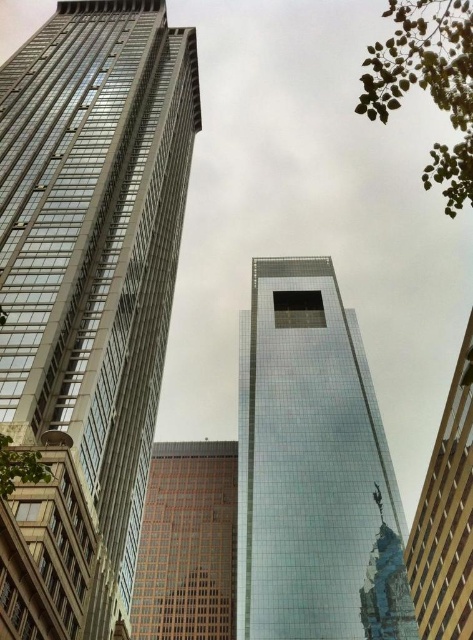
You are a drone operator tasked with flying a drone between two glassy steel structures in the city. The drone has a maximum flight range of 50 meters. Based on the scene, can your drone safely fly from the glassy steel skyscraper at center to the glassy steel tower at center without exceeding its range?

The distance between the glassy steel skyscraper at center and the glassy steel tower at center is 54.74 meters, which exceeds the drone operator maximum flight range of 50 meters. Therefore, the drone cannot safely fly between them without exceeding its range.

You are standing in the city square and see the brown brick building at center and the matte glass skyscraper at right. Which building is positioned to the left of the other?

The brown brick building at center is positioned to the left of the matte glass skyscraper at right.

You are an architect analyzing the cityscape. You need to determine which building has a greater width between the brown brick building at center and the matte glass skyscraper at right based on the image. Which one is wider?

The brown brick building at center is wider than the matte glass skyscraper at right.